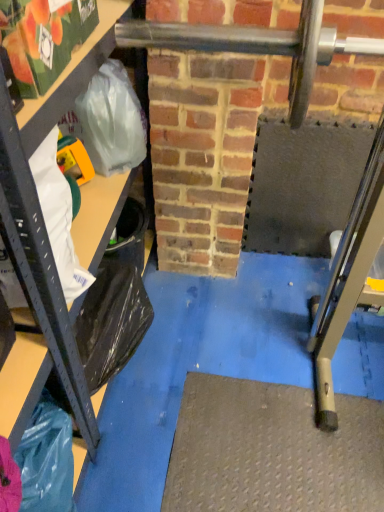
Question: Is metallic gray shelf at left surrounded by white plastic grocery bag at left?

Choices:
 (A) yes
 (B) no

Answer: (B)

Question: From a real-world perspective, is white plastic grocery bag at left located higher than metallic gray shelf at left?

Choices:
 (A) no
 (B) yes

Answer: (B)

Question: Is there a large distance between white plastic grocery bag at left and metallic gray shelf at left?

Choices:
 (A) no
 (B) yes

Answer: (A)

Question: Considering the relative positions of white plastic grocery bag at left and metallic gray shelf at left in the image provided, is white plastic grocery bag at left to the right of metallic gray shelf at left from the viewer's perspective?

Choices:
 (A) yes
 (B) no

Answer: (A)

Question: Is white plastic grocery bag at left not within metallic gray shelf at left?

Choices:
 (A) no
 (B) yes

Answer: (A)

Question: Can you confirm if white plastic grocery bag at left is shorter than metallic gray shelf at left?

Choices:
 (A) no
 (B) yes

Answer: (B)

Question: Would you say metallic gray shelf at left is a long distance from white plastic grocery bag at left?

Choices:
 (A) no
 (B) yes

Answer: (A)

Question: Can you confirm if metallic gray shelf at left is thinner than white plastic grocery bag at left?

Choices:
 (A) yes
 (B) no

Answer: (B)

Question: Is metallic gray shelf at left at the right side of white plastic grocery bag at left?

Choices:
 (A) no
 (B) yes

Answer: (A)

Question: Does metallic gray shelf at left have a greater height compared to white plastic grocery bag at left?

Choices:
 (A) no
 (B) yes

Answer: (B)

Question: Does metallic gray shelf at left appear on the left side of white plastic grocery bag at left?

Choices:
 (A) no
 (B) yes

Answer: (B)

Question: Is metallic gray shelf at left outside of white plastic grocery bag at left?

Choices:
 (A) yes
 (B) no

Answer: (A)

Question: Is white plastic grocery bag at left in front of or behind metallic gray shelf at left in the image?

Choices:
 (A) behind
 (B) front

Answer: (A)